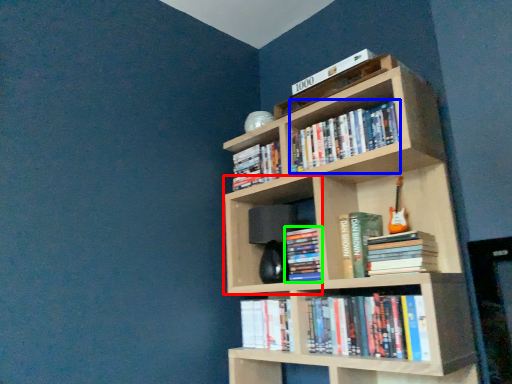
Question: Considering the real-world distances, which object is closest to shelf (highlighted by a red box)? book (highlighted by a blue box) or book (highlighted by a green box).

Choices:
 (A) book
 (B) book

Answer: (B)